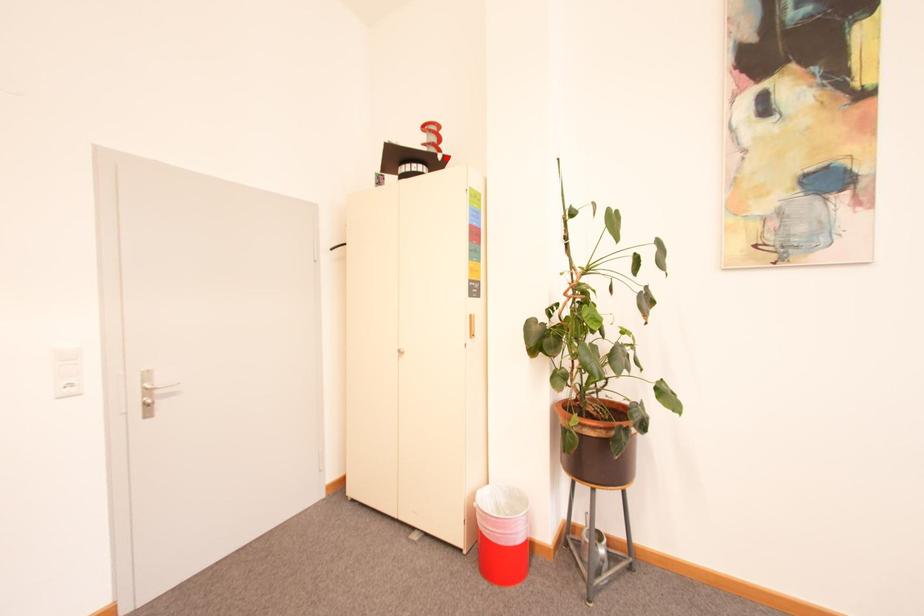
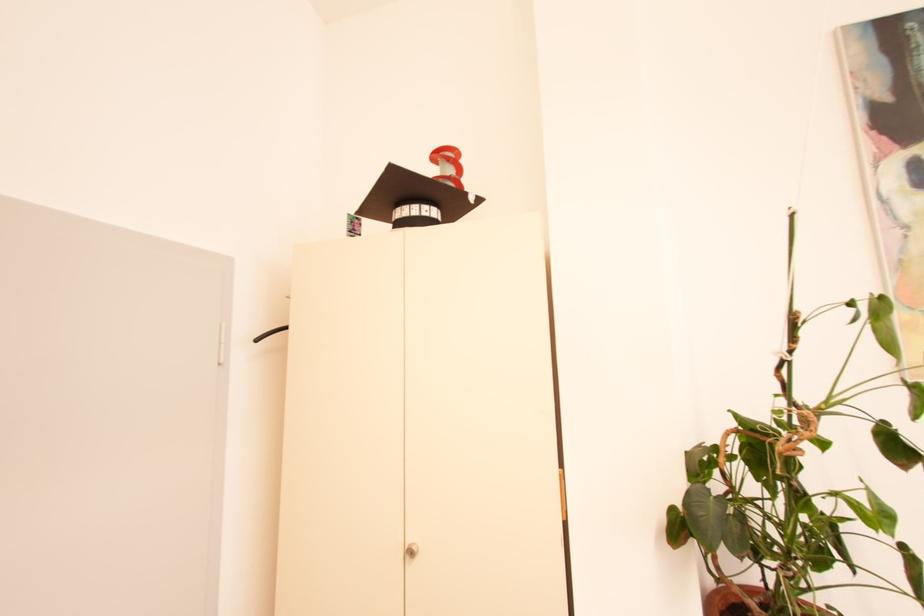
Question: A red point is marked in image1. In image2, is the corresponding 3D point closer to the camera or farther? Reply with the corresponding letter.

Choices:
 (A) The corresponding 3D point is closer.
 (B) The corresponding 3D point is farther.

Answer: (B)